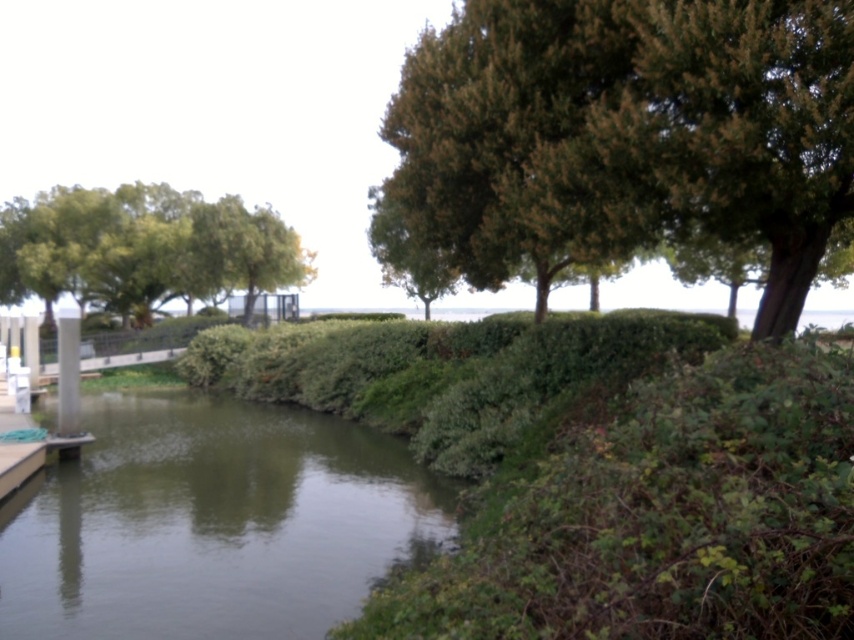
Which is in front, point (237, 428) or point (276, 236)?

Point (237, 428)

From the picture: Who is positioned more to the right, green grassy river at lower left or green leafy tree at left?

Positioned to the right is green grassy river at lower left.

Is point (199, 554) more distant than point (91, 244)?

No, it is in front of (91, 244).

The width and height of the screenshot is (854, 640). I want to click on green grassy river at lower left, so click(214, 522).

Who is more forward, (448, 145) or (127, 241)?

Positioned in front is point (448, 145).

Is point (518, 182) positioned in front of point (203, 202)?

Yes, point (518, 182) is closer to viewer.

This screenshot has height=640, width=854. In order to click on green leafy tree at upper right in this screenshot , I will do `click(630, 132)`.

Does green leafy tree at upper right have a greater height compared to green grassy river at lower left?

Yes.

At what (x,y) coordinates should I click in order to perform the action: click on green leafy tree at upper right. Please return your answer as a coordinate pair (x, y). The height and width of the screenshot is (640, 854). Looking at the image, I should click on (630, 132).